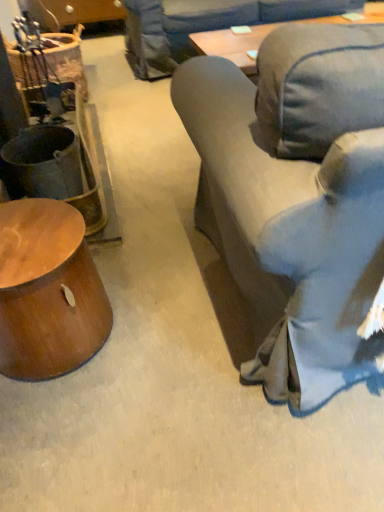
Locate an element on the screen. This screenshot has height=512, width=384. free spot in front of shiny brown wood side table at lower left is located at coordinates (70, 431).